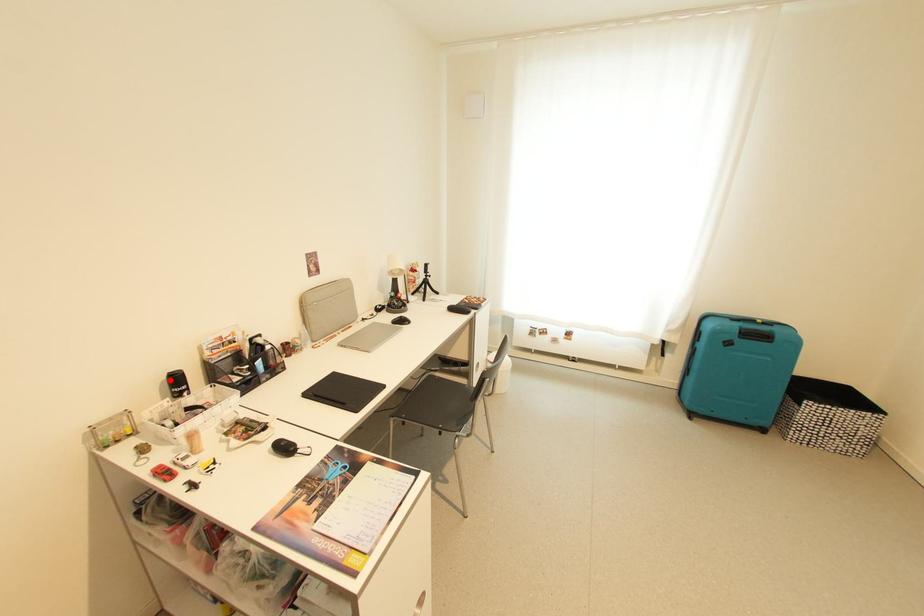
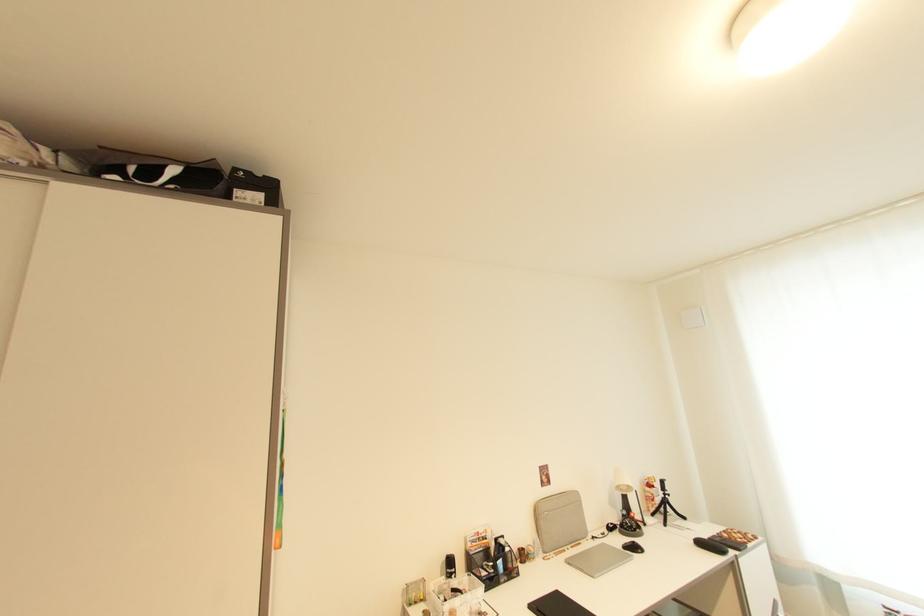
In the second image, find the point that corresponds to the highlighted location in the first image.

(450, 561)